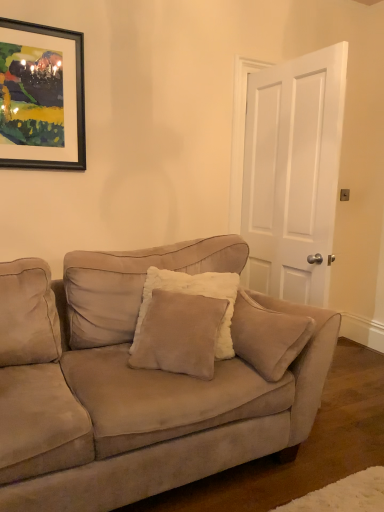
Image resolution: width=384 pixels, height=512 pixels. Describe the element at coordinates (293, 174) in the screenshot. I see `white matte door at center` at that location.

In the scene shown: In order to face white matte door at center, should I rotate leftwards or rightwards?

You should rotate right by 12.251 degrees.

This screenshot has height=512, width=384. Find the location of `suede/velvet pillow at center`. suede/velvet pillow at center is located at coordinates (193, 295).

Locate an element on the screen. The width and height of the screenshot is (384, 512). black matte picture frame at upper left is located at coordinates (41, 97).

You are a GUI agent. You are given a task and a screenshot of the screen. Output one action in this format:
    pyautogui.click(x=<x>, y=<y>)
    Task: Click on the white matte door at center
    The image size is (384, 512).
    Given the screenshot: What is the action you would take?
    pyautogui.click(x=293, y=174)

Which is correct: suede couch at center is inside white matte door at center, or outside of it?

suede couch at center exists outside the volume of white matte door at center.

From the image's perspective, which is above, suede couch at center or white matte door at center?

white matte door at center.

Measure the distance from suede couch at center to white matte door at center.

They are 34.93 inches apart.

Can you confirm if suede couch at center is shorter than white matte door at center?

Yes.

From the image's perspective, does white matte door at center appear higher than suede/velvet pillow at center?

Yes, from the image's perspective, white matte door at center is above suede/velvet pillow at center.

How different are the orientations of white matte door at center and suede/velvet pillow at center in degrees?

white matte door at center and suede/velvet pillow at center are facing 139 degrees away from each other.

Is white matte door at center positioned before suede/velvet pillow at center?

No, white matte door at center is behind suede/velvet pillow at center.

From a real-world perspective, does white matte door at center stand above suede/velvet pillow at center?

Yes, from a real-world perspective, white matte door at center is over suede/velvet pillow at center

Is black matte picture frame at upper left far from white matte door at center?

Yes, black matte picture frame at upper left and white matte door at center are quite far apart.

Considering the points (62, 162) and (311, 216), which point is behind, point (62, 162) or point (311, 216)?

Positioned behind is point (311, 216).

Between black matte picture frame at upper left and white matte door at center, which one has smaller width?

Thinner between the two is black matte picture frame at upper left.

From a real-world perspective, relative to white matte door at center, is black matte picture frame at upper left vertically above or below?

Clearly, from a real-world perspective, black matte picture frame at upper left is above white matte door at center.

Based on their positions, is suede/velvet pillow at center located to the left or right of suede couch at center?

suede/velvet pillow at center is to the right of suede couch at center.

Considering the positions of point (234, 278) and point (238, 411), is point (234, 278) closer or farther from the camera than point (238, 411)?

Clearly, point (234, 278) is more distant from the camera than point (238, 411).

From the image's perspective, relative to suede couch at center, is suede/velvet pillow at center above or below?

suede/velvet pillow at center is situated higher than suede couch at center in the image.

Is suede couch at center a part of suede/velvet pillow at center?

Actually, suede couch at center is outside suede/velvet pillow at center.

Is black matte picture frame at upper left at the back of suede couch at center?

suede couch at center does not have its back to black matte picture frame at upper left.

Is black matte picture frame at upper left completely or partially inside suede couch at center?

No, black matte picture frame at upper left is not surrounded by suede couch at center.

From a real-world perspective, is suede couch at center located beneath black matte picture frame at upper left?

Yes, from a real-world perspective, suede couch at center is under black matte picture frame at upper left.

Is white matte door at center not near black matte picture frame at upper left?

That's right, there is a large distance between white matte door at center and black matte picture frame at upper left.

From the image's perspective, which is below, white matte door at center or black matte picture frame at upper left?

white matte door at center is shown below in the image.

Does white matte door at center lie in front of black matte picture frame at upper left?

No, white matte door at center is behind black matte picture frame at upper left.

From the image's perspective, is suede couch at center on suede/velvet pillow at center?

Incorrect, from the image's perspective, suede couch at center is lower than suede/velvet pillow at center.

Considering the sizes of objects suede couch at center and suede/velvet pillow at center in the image provided, who is thinner, suede couch at center or suede/velvet pillow at center?

suede/velvet pillow at center.

Is suede couch at center with suede/velvet pillow at center?

No, suede couch at center is not beside suede/velvet pillow at center.

At what (x,y) coordinates should I click in order to perform the action: click on door to the right of suede couch at center. Please return your answer as a coordinate pair (x, y). The image size is (384, 512). Looking at the image, I should click on (293, 174).

Find the location of a particular element. This screenshot has height=512, width=384. pillow that is below the white matte door at center (from the image's perspective) is located at coordinates (193, 295).

From the picture: Which object lies further to the anchor point white matte door at center, suede couch at center or suede/velvet pillow at center?

suede couch at center is positioned further to the anchor white matte door at center.

Which object lies further to the anchor point suede/velvet pillow at center, suede couch at center or white matte door at center?

white matte door at center is positioned further to the anchor suede/velvet pillow at center.

When comparing their distances from suede/velvet pillow at center, does black matte picture frame at upper left or white matte door at center seem further?

black matte picture frame at upper left is further to suede/velvet pillow at center.

Considering their positions, is suede couch at center positioned closer to black matte picture frame at upper left than suede/velvet pillow at center?

Based on the image, suede/velvet pillow at center appears to be nearer to black matte picture frame at upper left.

From the image, which object appears to be farther from black matte picture frame at upper left, suede/velvet pillow at center or suede couch at center?

suede couch at center lies further to black matte picture frame at upper left than the other object.

From the image, which object appears to be farther from suede couch at center, black matte picture frame at upper left or suede/velvet pillow at center?

black matte picture frame at upper left.

Looking at the image, which one is located closer to black matte picture frame at upper left, suede/velvet pillow at center or white matte door at center?

suede/velvet pillow at center is positioned closer to the anchor black matte picture frame at upper left.

From the image, which object appears to be nearer to white matte door at center, suede/velvet pillow at center or suede couch at center?

suede/velvet pillow at center is positioned closer to the anchor white matte door at center.

Locate an element on the screen. pillow between black matte picture frame at upper left and suede couch at center in the vertical direction is located at coordinates (193, 295).

The image size is (384, 512). Find the location of `pillow between black matte picture frame at upper left and white matte door at center from left to right`. pillow between black matte picture frame at upper left and white matte door at center from left to right is located at coordinates (193, 295).

The height and width of the screenshot is (512, 384). What are the coordinates of `studio couch between black matte picture frame at upper left and white matte door at center` in the screenshot? It's located at (146, 379).

The height and width of the screenshot is (512, 384). I want to click on pillow between suede couch at center and white matte door at center in the front-back direction, so click(x=193, y=295).